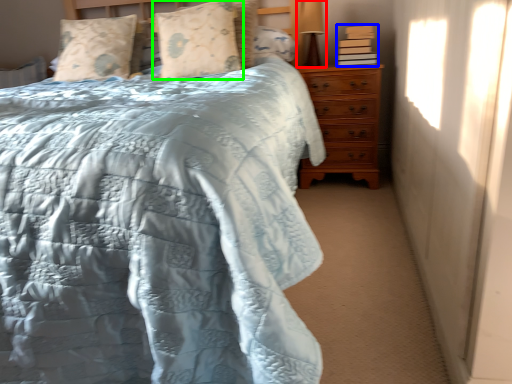
Question: Which object is the closest to the table lamp (highlighted by a red box)? Choose among these: book (highlighted by a blue box) or pillow (highlighted by a green box).

Choices:
 (A) book
 (B) pillow

Answer: (A)